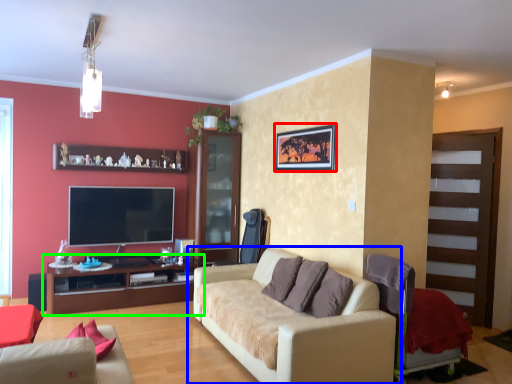
Question: Based on their relative distances, which object is nearer to picture frame (highlighted by a red box)? Choose from studio couch (highlighted by a blue box) and cabinetry (highlighted by a green box).

Choices:
 (A) studio couch
 (B) cabinetry

Answer: (A)